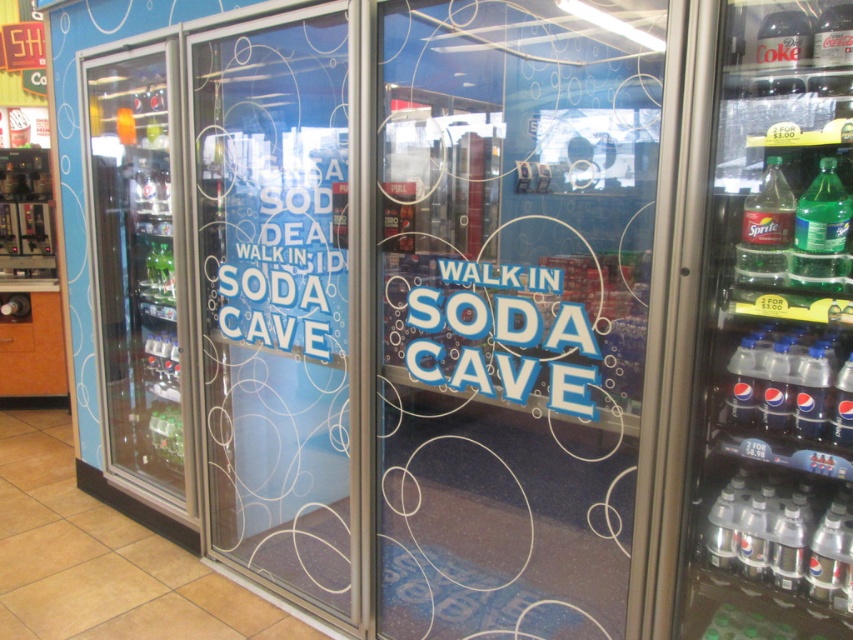
What do you see at coordinates (277, 296) in the screenshot? The height and width of the screenshot is (640, 853). I see `transparent plastic door at center` at bounding box center [277, 296].

Is transparent plastic door at center positioned in front of clear plastic bottle at lower right?

No, transparent plastic door at center is further to the viewer.

Where is `transparent plastic door at center`? transparent plastic door at center is located at coordinates (277, 296).

The image size is (853, 640). Identify the location of transparent plastic door at center. [x=277, y=296].

Does transparent plastic door at center appear under clear glass refrigerator at left?

Indeed, transparent plastic door at center is positioned under clear glass refrigerator at left.

Does point (303, 509) come closer to viewer compared to point (119, 195)?

Yes.

Find the location of a particular element. transparent plastic door at center is located at coordinates (277, 296).

Is point (144, 433) closer to viewer compared to point (738, 262)?

That is False.

Can you confirm if clear glass refrigerator at left is thinner than translucent plastic bottle at right?

No.

What do you see at coordinates (138, 262) in the screenshot?
I see `clear glass refrigerator at left` at bounding box center [138, 262].

Locate an element on the screen. clear glass refrigerator at left is located at coordinates (138, 262).